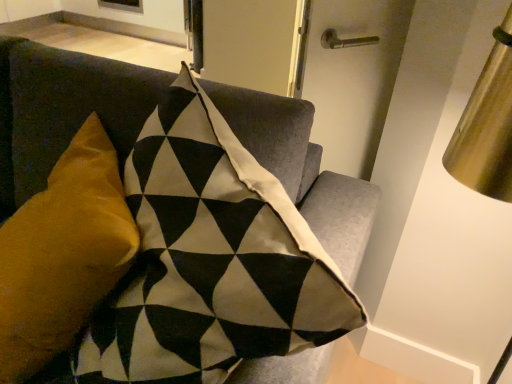
Question: In terms of width, does velvet cushion at upper left look wider or thinner when compared to velvet mustard pillow at left?

Choices:
 (A) wide
 (B) thin

Answer: (A)

Question: Is velvet cushion at upper left taller or shorter than velvet mustard pillow at left?

Choices:
 (A) tall
 (B) short

Answer: (A)

Question: Based on their sizes in the image, would you say velvet cushion at upper left is bigger or smaller than velvet mustard pillow at left?

Choices:
 (A) small
 (B) big

Answer: (B)

Question: Based on their sizes in the image, would you say velvet mustard pillow at left is bigger or smaller than velvet cushion at upper left?

Choices:
 (A) small
 (B) big

Answer: (A)

Question: In terms of height, does velvet mustard pillow at left look taller or shorter compared to velvet cushion at upper left?

Choices:
 (A) short
 (B) tall

Answer: (A)

Question: Is velvet mustard pillow at left to the left or to the right of velvet cushion at upper left in the image?

Choices:
 (A) left
 (B) right

Answer: (B)

Question: Is point (116, 244) closer or farther from the camera than point (73, 66)?

Choices:
 (A) farther
 (B) closer

Answer: (B)